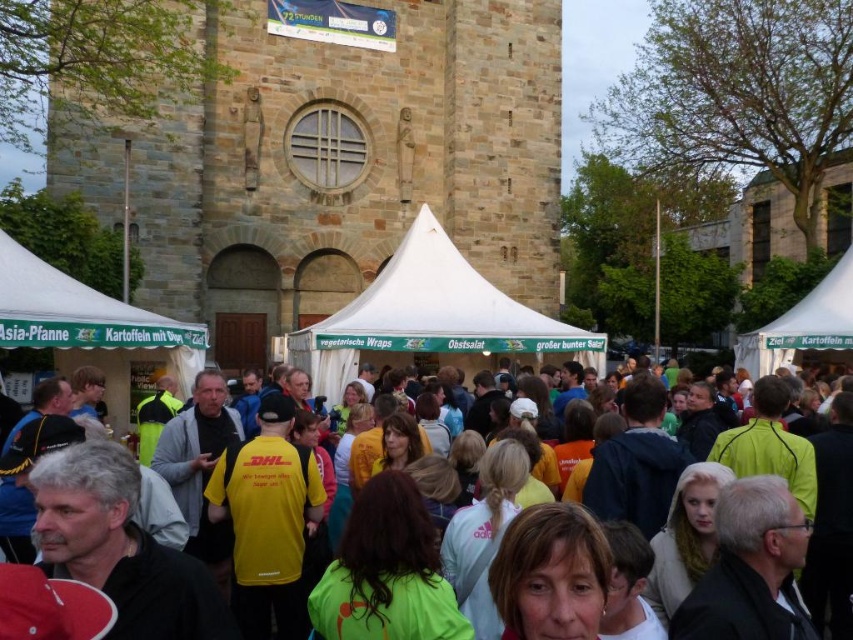
You are a photographer standing in front of the large stone building. You want to take a photo that includes both the yellow athletic shirt at center and the white canvas tent at center. Which object should you focus on first to ensure both are in frame?

The yellow athletic shirt at center is larger in size than the white canvas tent at center, so you should focus on the yellow athletic shirt at center first to ensure both are in frame.

You are standing at the point marked as point (189, 474) in the image. What is the nearest object to you?

The nearest object to you is the yellow athletic shirt at center, as the point (189, 474) corresponds to it.

You are a photographer trying to capture the brown stone church at center and the yellow athletic shirt at center in the same frame. Based on their sizes, which object should you focus on first to ensure both are in the frame?

The brown stone church at center is thinner than the yellow athletic shirt at center, so you should focus on the yellow athletic shirt at center first to ensure both fit in the frame.